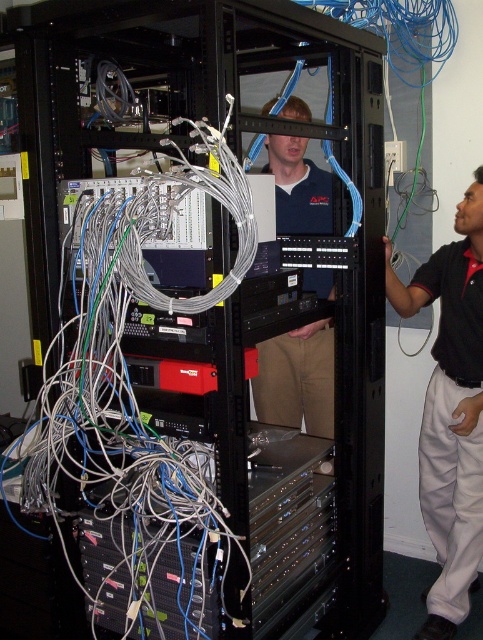
Does black cotton shirt at center lie in front of blue cotton shirt at center?

Yes, black cotton shirt at center is closer to the viewer.

Between black cotton shirt at center and blue cotton shirt at center, which one is positioned higher?

Positioned higher is blue cotton shirt at center.

Find the location of a particular element. black cotton shirt at center is located at coordinates (451, 412).

Locate an element on the screen. black cotton shirt at center is located at coordinates (451, 412).